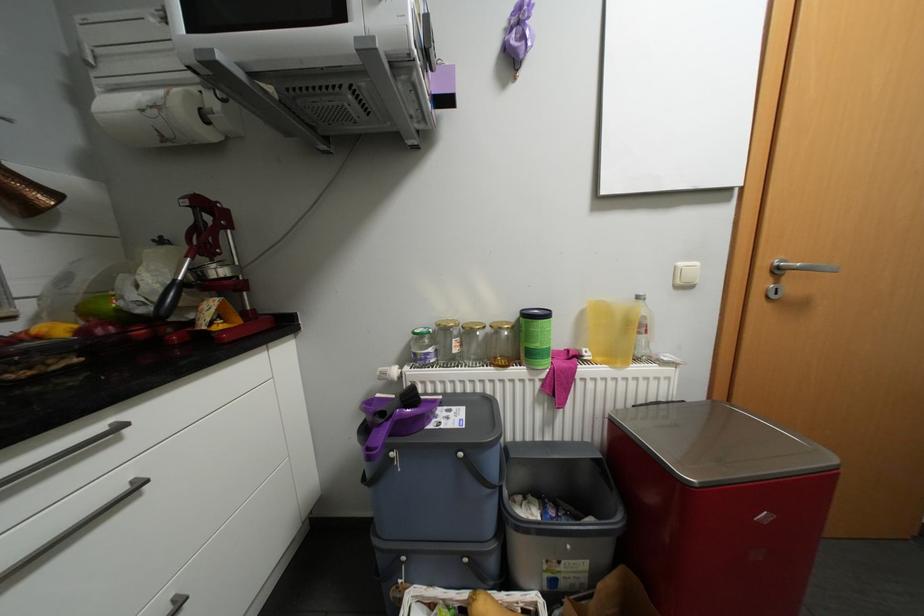
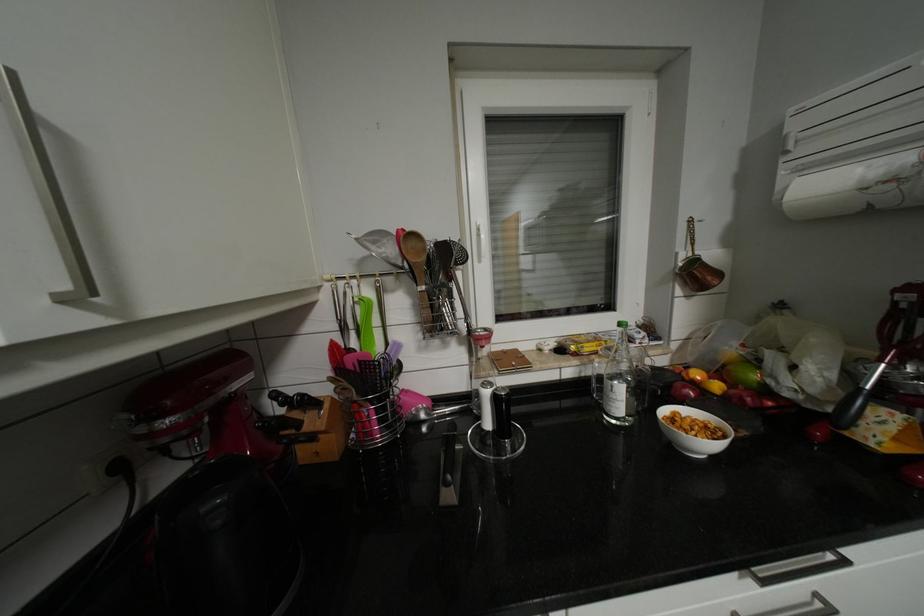
In the second image, find the point that corresponds to pixel 50 326 in the first image.

(704, 374)